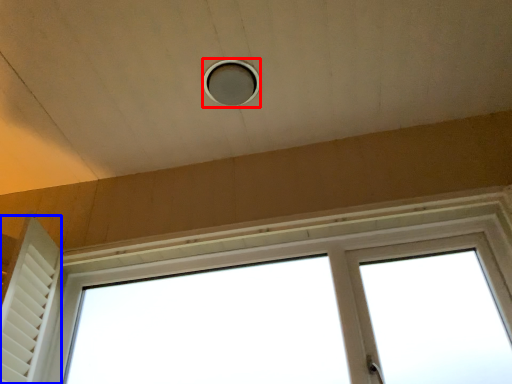
Question: Among these objects, which one is nearest to the camera, hole (highlighted by a red box) or shutter (highlighted by a blue box)?

Choices:
 (A) hole
 (B) shutter

Answer: (B)